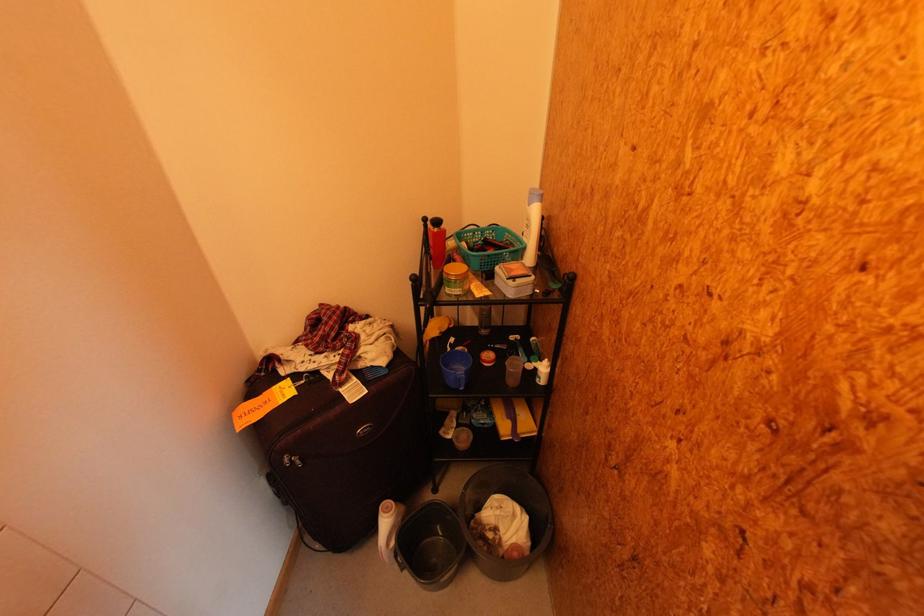
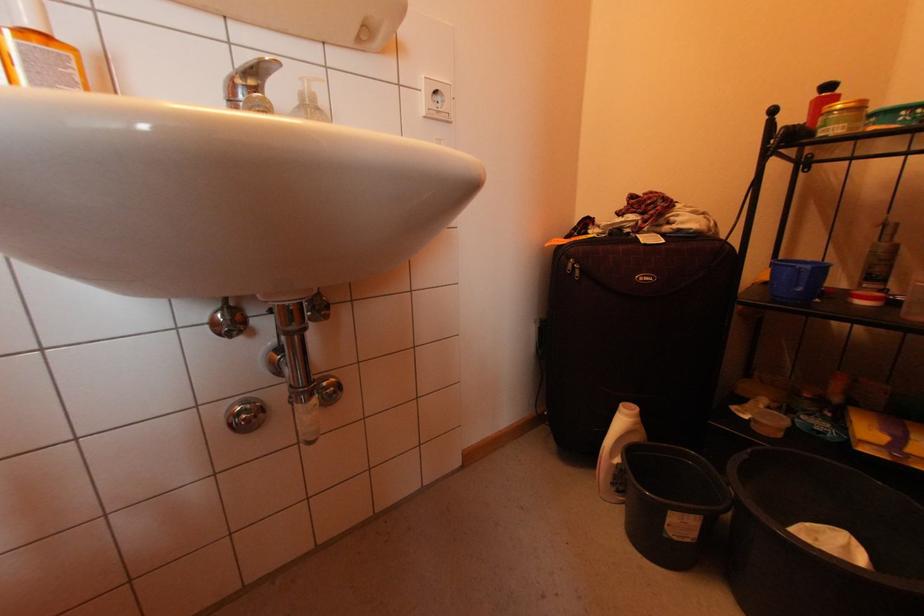
Find the pixel in the second image that matches point 466,387 in the first image.

(803, 286)